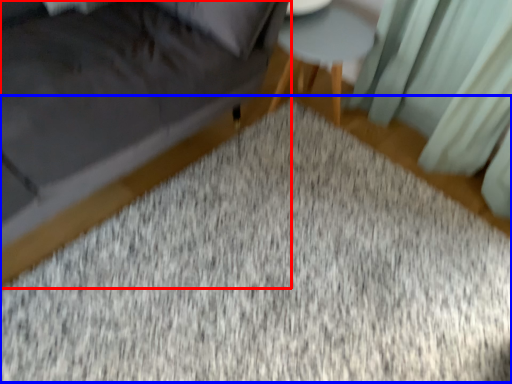
Question: Which point is closer to the camera, furniture (highlighted by a red box) or mat (highlighted by a blue box)?

Choices:
 (A) furniture
 (B) mat

Answer: (A)